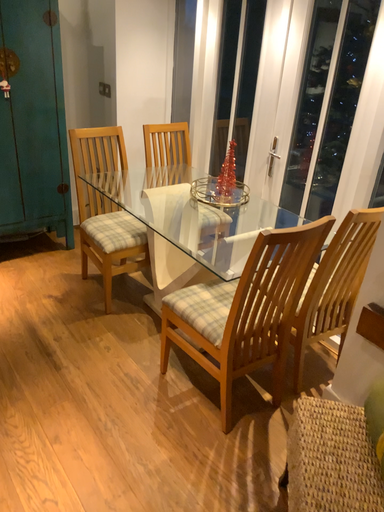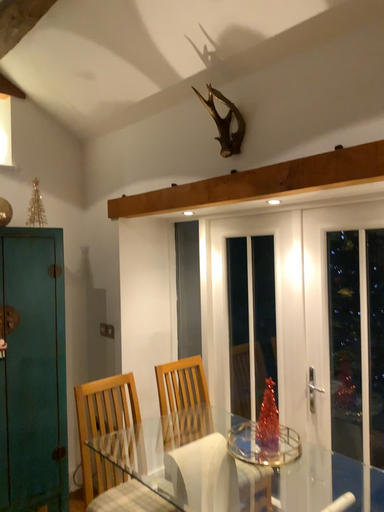
Question: Which way did the camera rotate in the video?

Choices:
 (A) rotated downward
 (B) rotated upward

Answer: (B)